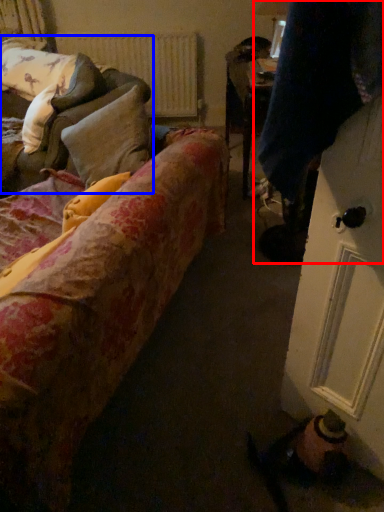
Question: Among these objects, which one is farthest to the camera, couple (highlighted by a red box) or studio couch (highlighted by a blue box)?

Choices:
 (A) couple
 (B) studio couch

Answer: (B)